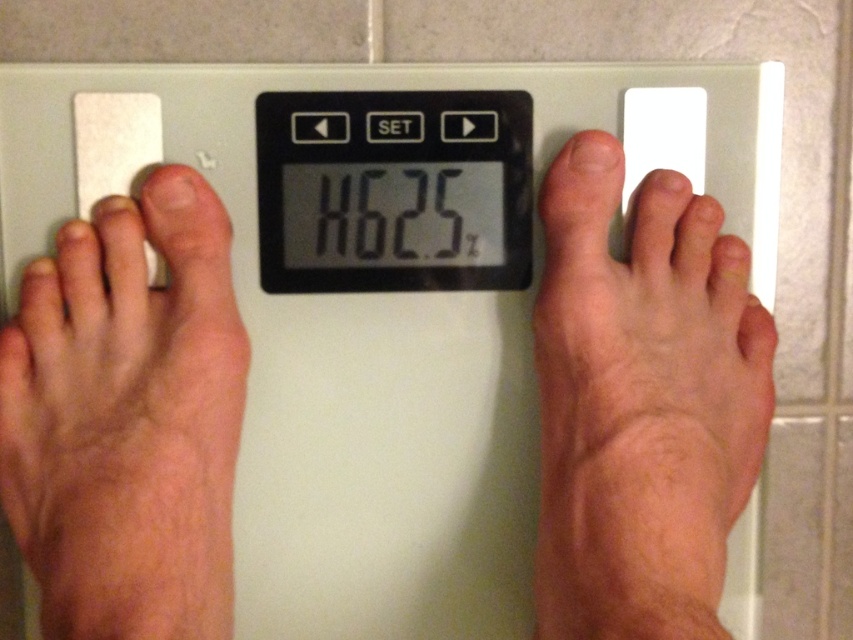
Can you confirm if skinny bare feet at center is taller than pale skin at right?

Indeed, skinny bare feet at center has a greater height compared to pale skin at right.

Describe the element at coordinates (641, 403) in the screenshot. Image resolution: width=853 pixels, height=640 pixels. I see `skinny bare feet at center` at that location.

Is point (718, 220) behind point (624, 602)?

Yes, it is.

Find the location of `skinny bare feet at center`. skinny bare feet at center is located at coordinates (641, 403).

Is point (13, 435) positioned before point (712, 108)?

Yes, it is in front of point (712, 108).

Which is below, dry skin foot at left or white plastic scale at center?

dry skin foot at left is below.

Locate an element on the screen. This screenshot has height=640, width=853. dry skin foot at left is located at coordinates (126, 419).

Can you confirm if pale skin at right is thinner than black plastic scale at center?

Yes.

Is the position of pale skin at right less distant than that of black plastic scale at center?

Yes, it is in front of black plastic scale at center.

This screenshot has height=640, width=853. I want to click on pale skin at right, so click(x=641, y=401).

Identify the location of pale skin at right. Image resolution: width=853 pixels, height=640 pixels. (641, 401).